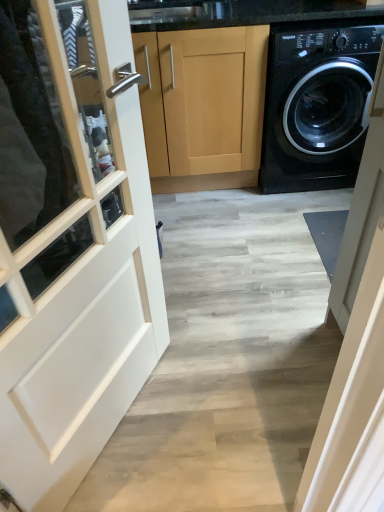
Question: From the image's perspective, relative to light wood cabinet at center, is black glossy washing machine at right above or below?

Choices:
 (A) below
 (B) above

Answer: (B)

Question: Is black glossy washing machine at right taller or shorter than light wood cabinet at center?

Choices:
 (A) tall
 (B) short

Answer: (B)

Question: Is point (299, 177) positioned closer to the camera than point (145, 44)?

Choices:
 (A) closer
 (B) farther

Answer: (B)

Question: Based on their sizes in the image, would you say light wood cabinet at center is bigger or smaller than black glossy washing machine at right?

Choices:
 (A) big
 (B) small

Answer: (A)

Question: In terms of height, does light wood cabinet at center look taller or shorter compared to black glossy washing machine at right?

Choices:
 (A) tall
 (B) short

Answer: (A)

Question: Is point (188, 97) positioned closer to the camera than point (289, 113)?

Choices:
 (A) closer
 (B) farther

Answer: (A)

Question: In the image, is light wood cabinet at center positioned in front of or behind black glossy washing machine at right?

Choices:
 (A) front
 (B) behind

Answer: (B)